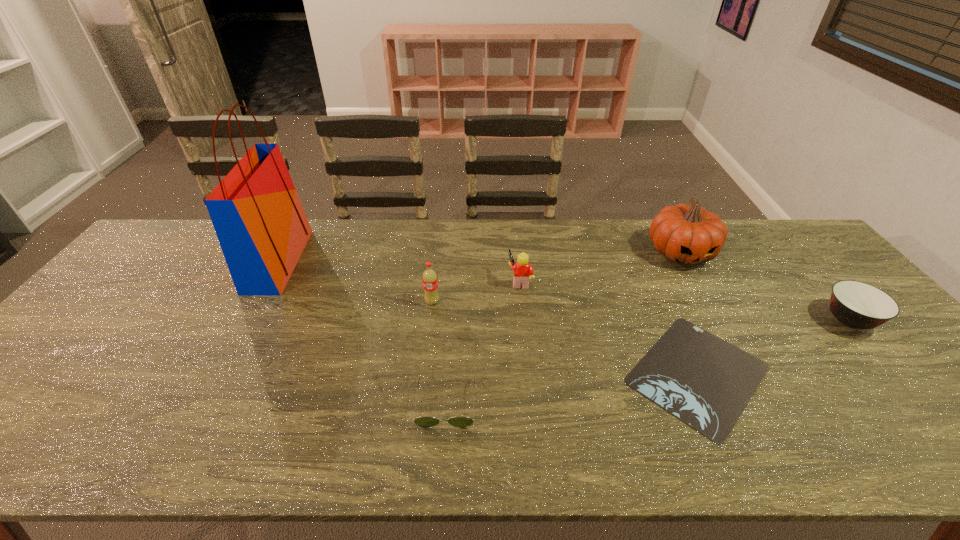
Where is `vacant space at the near right corner`? This screenshot has width=960, height=540. vacant space at the near right corner is located at coordinates (938, 439).

Identify the location of free area in between the Lego and the third shortest object. This screenshot has width=960, height=540. (684, 301).

I want to click on vacant area between the sunglasses and the shortest object, so click(x=572, y=388).

You are a GUI agent. You are given a task and a screenshot of the screen. Output one action in this format:
    pyautogui.click(x=<x>, y=<y>)
    Task: Click on the vacant space that's between the soup bowl and the soda
    This screenshot has height=540, width=960.
    Given the screenshot: What is the action you would take?
    pyautogui.click(x=640, y=311)

Identify the location of free space that is in between the sixth shortest object and the shortest object. Image resolution: width=960 pixels, height=540 pixels. (689, 313).

The height and width of the screenshot is (540, 960). What are the coordinates of `free space between the leftmost object and the fifth shortest object` in the screenshot? It's located at (355, 281).

Locate an element on the screen. empty location between the shopping bag and the Lego is located at coordinates (399, 271).

Locate an element on the screen. This screenshot has width=960, height=540. free space that is in between the leftmost object and the sixth tallest object is located at coordinates (362, 332).

Identify the location of empty space between the mousepad and the fifth shortest object. (564, 338).

You are a GUI agent. You are given a task and a screenshot of the screen. Output one action in this format:
    pyautogui.click(x=<x>, y=<y>)
    Task: Click on the empty space between the sixth shortest object and the shopping bag
    The image size is (960, 540).
    Given the screenshot: What is the action you would take?
    pyautogui.click(x=480, y=256)